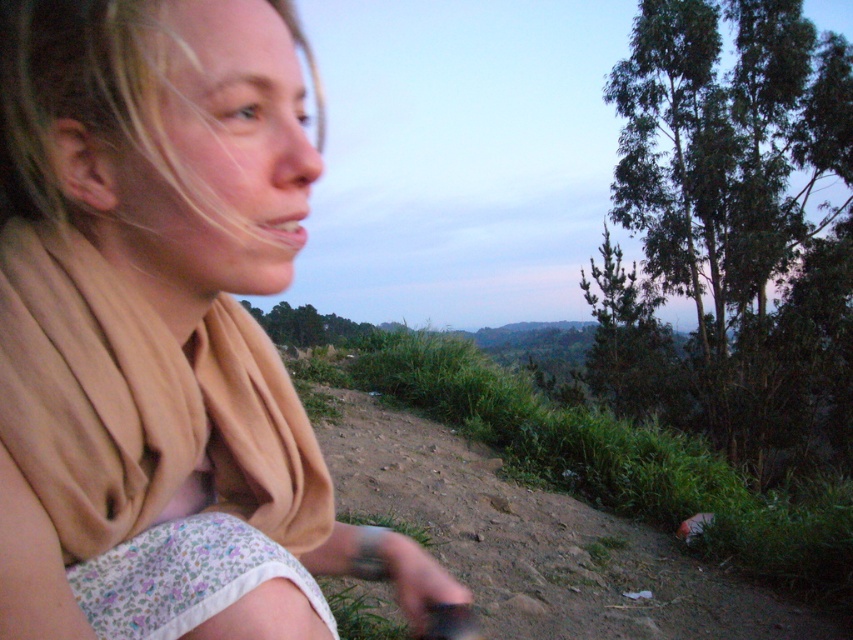
You are planning to place a small garden statue that is 10 feet wide between the beige fabric scarf at upper left and the brown dirt track at lower center. Will the statue fit between them without overlapping either object?

The distance between the beige fabric scarf at upper left and the brown dirt track at lower center is 10.15 feet. Since the statue is 10 feet wide, it will fit between them with a small gap of 0.15 feet remaining.

You are a hiker who wants to take a photo of the brown dirt track at lower center. However, the beige fabric scarf at upper left is blocking your view. Can you move the scarf to get a clear shot?

The beige fabric scarf at upper left is in front of the brown dirt track at lower center, so you cannot move the scarf as it is part of the scene and not an object you can physically move.

Looking at this image, you are an artist trying to sketch the scene. You want to place the beige fabric scarf at upper left accurately. Where should you position it on your grid paper that uses coordinates from 0 to 1 in both x and y axes?

The beige fabric scarf at upper left should be placed at the coordinate point of 0.522 on the x axis and 0.191 on the y axis.